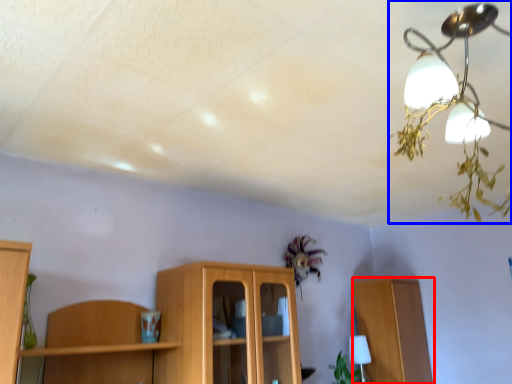
Question: Which of the following is the closest to the observer, cabinetry (highlighted by a red box) or lamp (highlighted by a blue box)?

Choices:
 (A) cabinetry
 (B) lamp

Answer: (B)